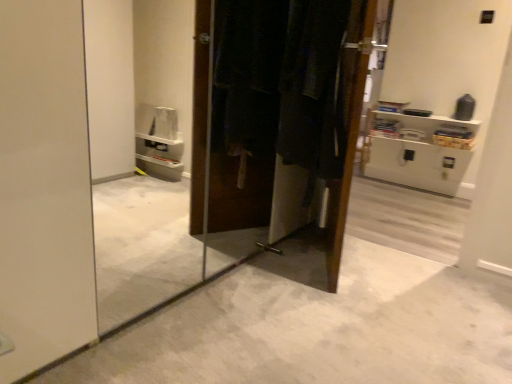
Question: Considering the relative positions of dark fabric laundry at center and white plastic shelf at upper right in the image provided, is dark fabric laundry at center to the right of white plastic shelf at upper right from the viewer's perspective?

Choices:
 (A) no
 (B) yes

Answer: (A)

Question: Does dark fabric laundry at center lie behind white plastic shelf at upper right?

Choices:
 (A) yes
 (B) no

Answer: (B)

Question: From the image's perspective, does dark fabric laundry at center appear lower than white plastic shelf at upper right?

Choices:
 (A) no
 (B) yes

Answer: (B)

Question: Is dark fabric laundry at center next to white plastic shelf at upper right?

Choices:
 (A) yes
 (B) no

Answer: (B)

Question: Can you confirm if dark fabric laundry at center is positioned to the left of white plastic shelf at upper right?

Choices:
 (A) yes
 (B) no

Answer: (A)

Question: Would you consider dark fabric laundry at center to be distant from white plastic shelf at upper right?

Choices:
 (A) no
 (B) yes

Answer: (B)

Question: From the image's perspective, is white plastic shelf at upper right located above dark fabric laundry at center?

Choices:
 (A) no
 (B) yes

Answer: (B)

Question: From the image's perspective, is white plastic shelf at upper right under dark fabric laundry at center?

Choices:
 (A) yes
 (B) no

Answer: (B)

Question: From a real-world perspective, does white plastic shelf at upper right stand above dark fabric laundry at center?

Choices:
 (A) no
 (B) yes

Answer: (A)

Question: Does white plastic shelf at upper right appear on the right side of dark fabric laundry at center?

Choices:
 (A) no
 (B) yes

Answer: (B)

Question: Would you say white plastic shelf at upper right contains dark fabric laundry at center?

Choices:
 (A) no
 (B) yes

Answer: (A)

Question: Is white plastic shelf at upper right facing towards dark fabric laundry at center?

Choices:
 (A) no
 (B) yes

Answer: (B)

Question: From a real-world perspective, is dark fabric laundry at center physically located above or below white plastic shelf at upper right?

Choices:
 (A) above
 (B) below

Answer: (A)